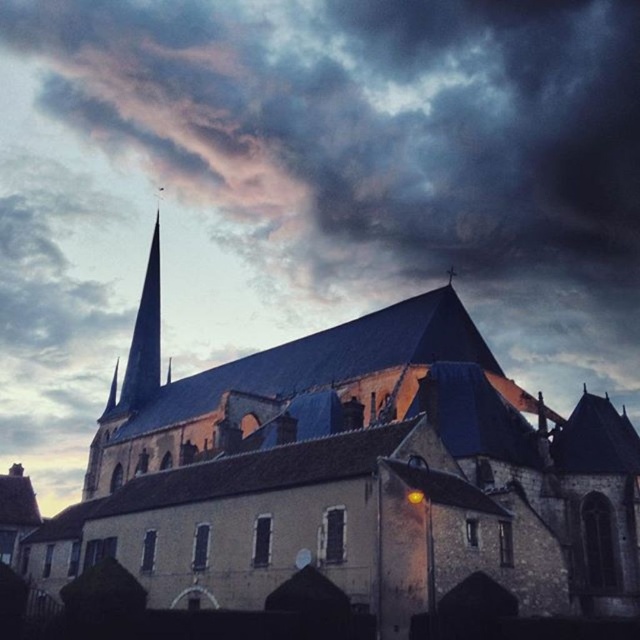
Question: Can you confirm if stone church at center is bigger than smooth dark gray spire at upper left?

Choices:
 (A) yes
 (B) no

Answer: (B)

Question: Is stone church at center in front of smooth dark gray spire at upper left?

Choices:
 (A) no
 (B) yes

Answer: (B)

Question: In this image, where is stone church at center located relative to smooth dark gray spire at upper left?

Choices:
 (A) left
 (B) right

Answer: (B)

Question: Which object appears closest to the camera in this image?

Choices:
 (A) smooth dark gray spire at upper left
 (B) stone church at center

Answer: (B)